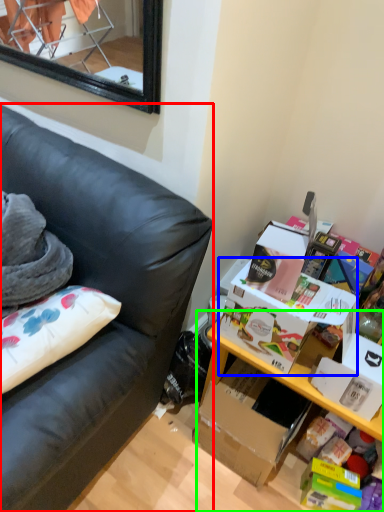
Question: Estimate the real-world distances between objects in this image. Which object is farther from studio couch (highlighted by a red box), storage box (highlighted by a blue box) or table (highlighted by a green box)?

Choices:
 (A) storage box
 (B) table

Answer: (B)